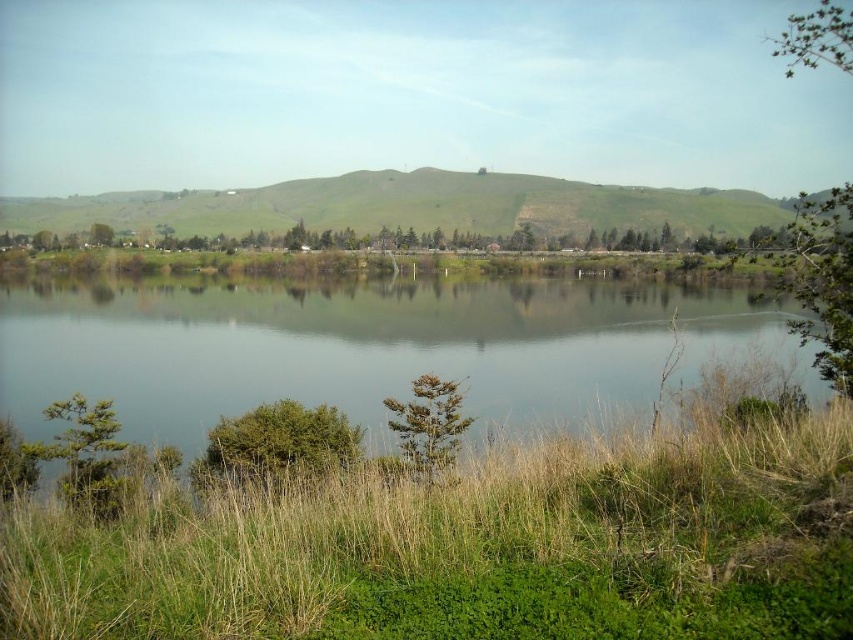
You are standing at the edge of the lake and notice a point marked at coordinates (468, 536). What type of vegetation is located at that point?

The point at (468, 536) has green grass at lower center.

You are standing at the edge of the scene and want to walk towards the transparent water at center. Which direction should you move relative to the green grass at lower center?

You should move upwards away from the green grass at lower center to reach the transparent water at center because the green grass at lower center is below transparent water at center.